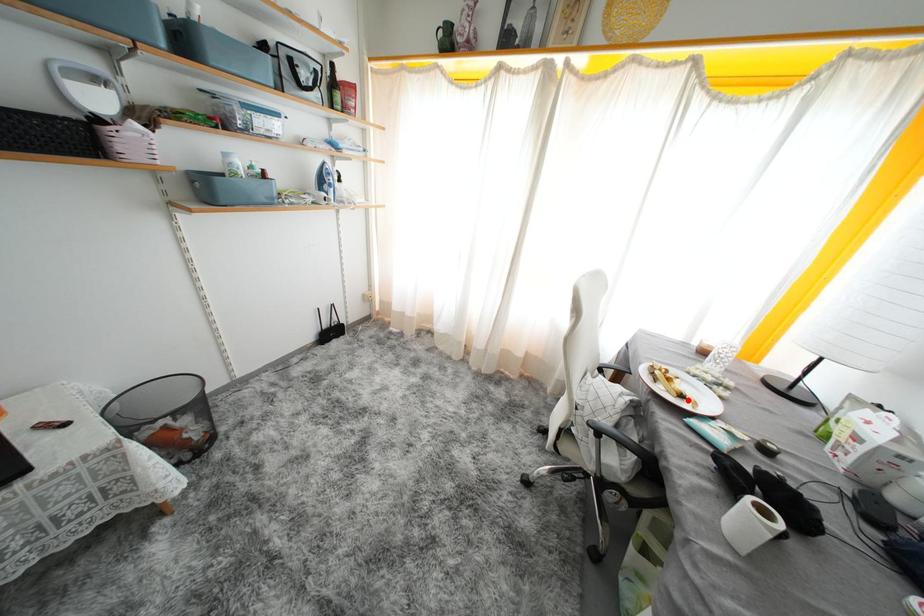
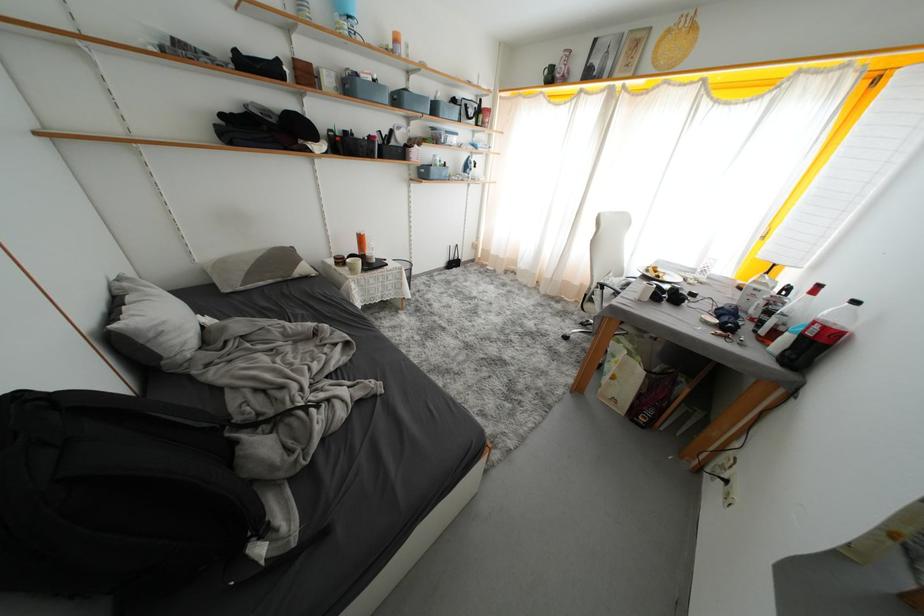
Find the pixel in the second image that matches the highlighted location in the first image.

(664, 281)